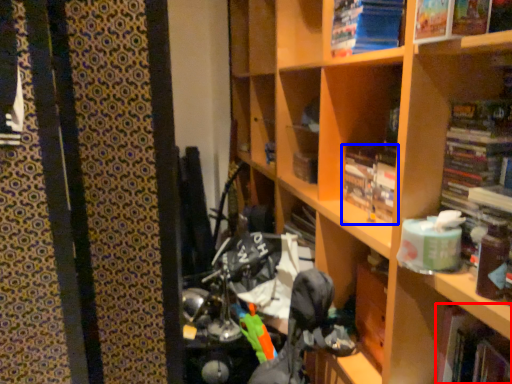
Question: Which object appears closest to the camera in this image, book (highlighted by a red box) or book (highlighted by a blue box)?

Choices:
 (A) book
 (B) book

Answer: (A)